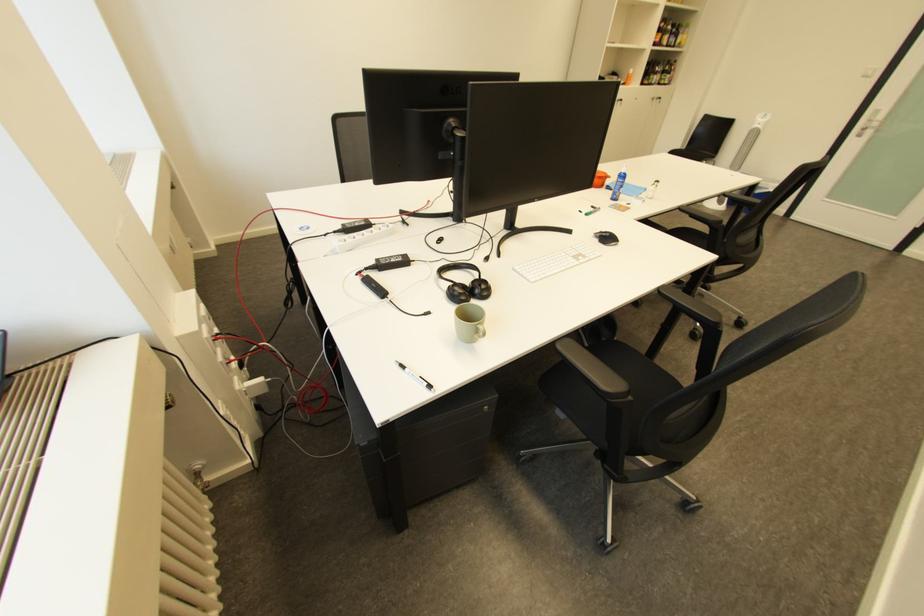
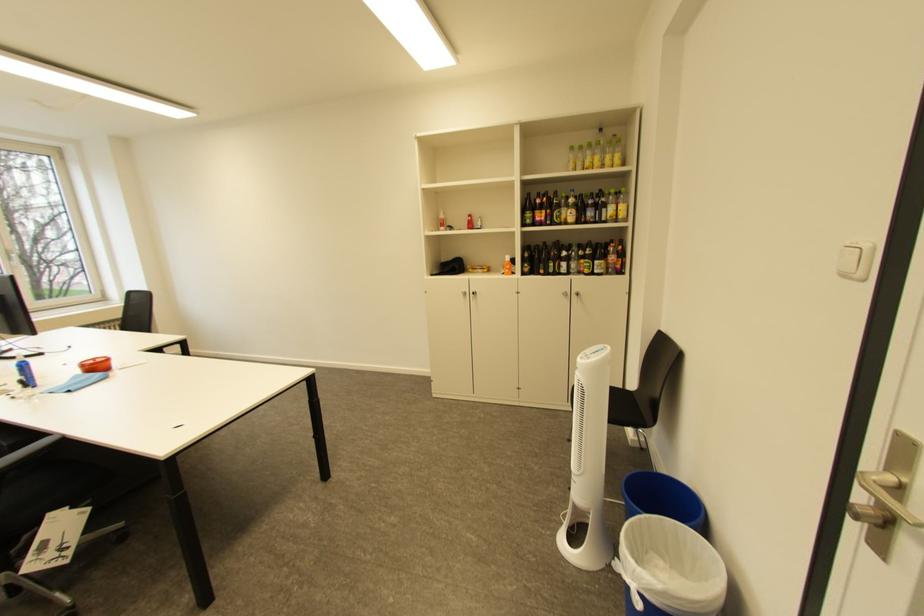
Where in the second image is the point corresponding to point (873, 77) from the first image?

(855, 277)